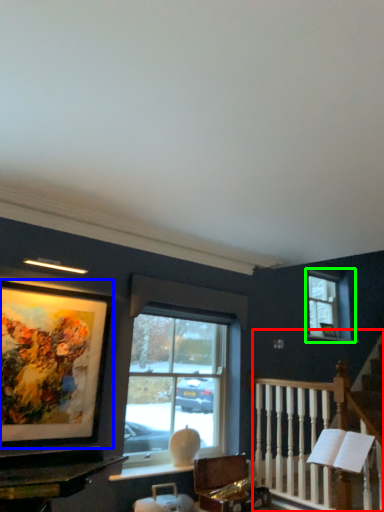
Question: Considering the real-world distances, which object is closest to rail (highlighted by a red box)? picture frame (highlighted by a blue box) or window (highlighted by a green box).

Choices:
 (A) picture frame
 (B) window

Answer: (B)